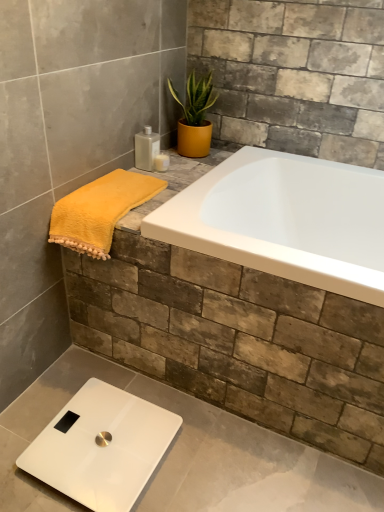
What is the approximate width of yellow fluffy towel at left?

yellow fluffy towel at left is 7.66 inches in width.

The width and height of the screenshot is (384, 512). What do you see at coordinates (194, 116) in the screenshot?
I see `matte yellow pot at upper center` at bounding box center [194, 116].

At what (x,y) coordinates should I click in order to perform the action: click on white glossy scale at lower left. Please return your answer as a coordinate pair (x, y). Looking at the image, I should click on (101, 447).

In order to face translucent plastic soap dispenser at upper center, placed as the 1th toiletry when sorted from right to left, should I rotate leftwards or rightwards?

Turn left by 3.985 degrees to look at translucent plastic soap dispenser at upper center, placed as the 1th toiletry when sorted from right to left.

At what (x,y) coordinates should I click in order to perform the action: click on yellow fluffy towel at left. Please return your answer as a coordinate pair (x, y). Looking at the image, I should click on (99, 211).

Can you confirm if translucent plastic bottle at upper center, acting as the 1th toiletry starting from the left, is smaller than white glossy scale at lower left?

Correct, translucent plastic bottle at upper center, acting as the 1th toiletry starting from the left, occupies less space than white glossy scale at lower left.

Between translucent plastic bottle at upper center, acting as the 1th toiletry starting from the left, and white glossy scale at lower left, which one appears on the right side from the viewer's perspective?

From the viewer's perspective, translucent plastic bottle at upper center, acting as the 1th toiletry starting from the left, appears more on the right side.

Based on the photo, is translucent plastic bottle at upper center, acting as the 1th toiletry starting from the left, oriented towards white glossy scale at lower left?

No, translucent plastic bottle at upper center, acting as the 1th toiletry starting from the left, is not aimed at white glossy scale at lower left.

How different are the orientations of white glossy scale at lower left and matte yellow pot at upper center in degrees?

The facing directions of white glossy scale at lower left and matte yellow pot at upper center are 1.71 degrees apart.

Which is correct: white glossy scale at lower left is inside matte yellow pot at upper center, or outside of it?

white glossy scale at lower left cannot be found inside matte yellow pot at upper center.

In the scene shown: Considering the relative positions of white glossy scale at lower left and matte yellow pot at upper center in the image provided, is white glossy scale at lower left to the left or to the right of matte yellow pot at upper center?

white glossy scale at lower left is to the left of matte yellow pot at upper center.

Is white glossy scale at lower left directly adjacent to matte yellow pot at upper center?

No, white glossy scale at lower left is not touching matte yellow pot at upper center.

Considering the sizes of yellow fluffy towel at left and matte yellow pot at upper center in the image, is yellow fluffy towel at left wider or thinner than matte yellow pot at upper center?

Clearly, yellow fluffy towel at left has more width compared to matte yellow pot at upper center.

From the image's perspective, would you say yellow fluffy towel at left is shown under matte yellow pot at upper center?

Correct, yellow fluffy towel at left appears lower than matte yellow pot at upper center in the image.

From the picture: Is yellow fluffy towel at left bigger or smaller than matte yellow pot at upper center?

yellow fluffy towel at left is bigger than matte yellow pot at upper center.

Is point (125, 212) more distant than point (183, 144)?

No, it is in front of (183, 144).

From the image's perspective, is matte yellow pot at upper center located beneath translucent plastic soap dispenser at upper center, which is the 2th toiletry in left-to-right order?

Actually, matte yellow pot at upper center appears above translucent plastic soap dispenser at upper center, which is the 2th toiletry in left-to-right order, in the image.

Image resolution: width=384 pixels, height=512 pixels. What are the coordinates of `toiletry behind the matte yellow pot at upper center` in the screenshot? It's located at (161, 162).

Is matte yellow pot at upper center not close to translucent plastic soap dispenser at upper center, which is the 2th toiletry in left-to-right order?

They are positioned close to each other.

Considering the sizes of translucent plastic soap dispenser at upper center, placed as the 1th toiletry when sorted from right to left, and translucent plastic bottle at upper center, marked as the 2th toiletry in a right-to-left arrangement, in the image, is translucent plastic soap dispenser at upper center, placed as the 1th toiletry when sorted from right to left, taller or shorter than translucent plastic bottle at upper center, marked as the 2th toiletry in a right-to-left arrangement,?

translucent plastic soap dispenser at upper center, placed as the 1th toiletry when sorted from right to left, is shorter than translucent plastic bottle at upper center, marked as the 2th toiletry in a right-to-left arrangement.

Is translucent plastic soap dispenser at upper center, which is the 2th toiletry in left-to-right order, positioned with its back to translucent plastic bottle at upper center, marked as the 2th toiletry in a right-to-left arrangement?

Yes.

Does point (169, 160) appear closer or farther from the camera than point (145, 147)?

Point (169, 160) is positioned farther from the camera compared to point (145, 147).

From a real-world perspective, is translucent plastic soap dispenser at upper center, which is the 2th toiletry in left-to-right order, positioned under translucent plastic bottle at upper center, marked as the 2th toiletry in a right-to-left arrangement, based on gravity?

Yes, from a real-world perspective, translucent plastic soap dispenser at upper center, which is the 2th toiletry in left-to-right order, is beneath translucent plastic bottle at upper center, marked as the 2th toiletry in a right-to-left arrangement.

Between yellow fluffy towel at left and translucent plastic soap dispenser at upper center, which is the 2th toiletry in left-to-right order, which one has less height?

translucent plastic soap dispenser at upper center, which is the 2th toiletry in left-to-right order.

Which point is more forward, (136, 195) or (168, 164)?

The point (136, 195) is closer.

Is yellow fluffy towel at left situated inside translucent plastic soap dispenser at upper center, which is the 2th toiletry in left-to-right order, or outside?

yellow fluffy towel at left is not enclosed by translucent plastic soap dispenser at upper center, which is the 2th toiletry in left-to-right order.

From a real-world perspective, is yellow fluffy towel at left under translucent plastic soap dispenser at upper center, which is the 2th toiletry in left-to-right order?

Yes, from a real-world perspective, yellow fluffy towel at left is beneath translucent plastic soap dispenser at upper center, which is the 2th toiletry in left-to-right order.

From the image's perspective, is matte yellow pot at upper center above or below translucent plastic bottle at upper center, acting as the 1th toiletry starting from the left?

From the image's perspective, matte yellow pot at upper center appears above translucent plastic bottle at upper center, acting as the 1th toiletry starting from the left.

Is matte yellow pot at upper center facing towards translucent plastic bottle at upper center, acting as the 1th toiletry starting from the left?

Yes, matte yellow pot at upper center is oriented towards translucent plastic bottle at upper center, acting as the 1th toiletry starting from the left.

Can you tell me how much matte yellow pot at upper center and translucent plastic bottle at upper center, marked as the 2th toiletry in a right-to-left arrangement, differ in facing direction?

The facing directions of matte yellow pot at upper center and translucent plastic bottle at upper center, marked as the 2th toiletry in a right-to-left arrangement, are 87.5 degrees apart.

Which point is more distant from viewer, (x=182, y=124) or (x=148, y=166)?

Positioned behind is point (x=182, y=124).

Where is `scale that appears in front of the translucent plastic bottle at upper center, marked as the 2th toiletry in a right-to-left arrangement`? scale that appears in front of the translucent plastic bottle at upper center, marked as the 2th toiletry in a right-to-left arrangement is located at coordinates pos(101,447).

At what (x,y) coordinates should I click in order to perform the action: click on houseplant on the right of the white glossy scale at lower left. Please return your answer as a coordinate pair (x, y). This screenshot has width=384, height=512. Looking at the image, I should click on (194, 116).

When comparing their distances from translucent plastic soap dispenser at upper center, placed as the 1th toiletry when sorted from right to left, does translucent plastic bottle at upper center, marked as the 2th toiletry in a right-to-left arrangement, or matte yellow pot at upper center seem further?

The object further to translucent plastic soap dispenser at upper center, placed as the 1th toiletry when sorted from right to left, is matte yellow pot at upper center.

Looking at the image, which one is located further to translucent plastic bottle at upper center, marked as the 2th toiletry in a right-to-left arrangement, matte yellow pot at upper center or translucent plastic soap dispenser at upper center, placed as the 1th toiletry when sorted from right to left?

matte yellow pot at upper center lies further to translucent plastic bottle at upper center, marked as the 2th toiletry in a right-to-left arrangement, than the other object.

When comparing their distances from white glossy scale at lower left, does matte yellow pot at upper center or yellow fluffy towel at left seem further?

The object further to white glossy scale at lower left is matte yellow pot at upper center.

Looking at this image, estimate the real-world distances between objects in this image. Which object is closer to white glossy scale at lower left, translucent plastic bottle at upper center, marked as the 2th toiletry in a right-to-left arrangement, or translucent plastic soap dispenser at upper center, which is the 2th toiletry in left-to-right order?

translucent plastic bottle at upper center, marked as the 2th toiletry in a right-to-left arrangement, is positioned closer to the anchor white glossy scale at lower left.

From the image, which object appears to be nearer to translucent plastic bottle at upper center, acting as the 1th toiletry starting from the left, yellow fluffy towel at left or matte yellow pot at upper center?

matte yellow pot at upper center is positioned closer to the anchor translucent plastic bottle at upper center, acting as the 1th toiletry starting from the left.

When comparing their distances from translucent plastic soap dispenser at upper center, which is the 2th toiletry in left-to-right order, does white glossy scale at lower left or matte yellow pot at upper center seem further?

Based on the image, white glossy scale at lower left appears to be further to translucent plastic soap dispenser at upper center, which is the 2th toiletry in left-to-right order.

Estimate the real-world distances between objects in this image. Which object is further from yellow fluffy towel at left, translucent plastic bottle at upper center, marked as the 2th toiletry in a right-to-left arrangement, or white glossy scale at lower left?

white glossy scale at lower left.

Estimate the real-world distances between objects in this image. Which object is further from matte yellow pot at upper center, yellow fluffy towel at left or translucent plastic bottle at upper center, acting as the 1th toiletry starting from the left?

yellow fluffy towel at left lies further to matte yellow pot at upper center than the other object.

Find the location of a particular element. The height and width of the screenshot is (512, 384). toiletry that lies between matte yellow pot at upper center and translucent plastic soap dispenser at upper center, placed as the 1th toiletry when sorted from right to left, from top to bottom is located at coordinates (146, 148).

Locate an element on the screen. The width and height of the screenshot is (384, 512). toiletry between yellow fluffy towel at left and translucent plastic soap dispenser at upper center, which is the 2th toiletry in left-to-right order, from front to back is located at coordinates (146, 148).

Where is `toiletry between translucent plastic bottle at upper center, marked as the 2th toiletry in a right-to-left arrangement, and white glossy scale at lower left in the up-down direction`? This screenshot has height=512, width=384. toiletry between translucent plastic bottle at upper center, marked as the 2th toiletry in a right-to-left arrangement, and white glossy scale at lower left in the up-down direction is located at coordinates (161, 162).

Identify the location of bath towel that lies between translucent plastic soap dispenser at upper center, placed as the 1th toiletry when sorted from right to left, and white glossy scale at lower left from top to bottom. (99, 211).